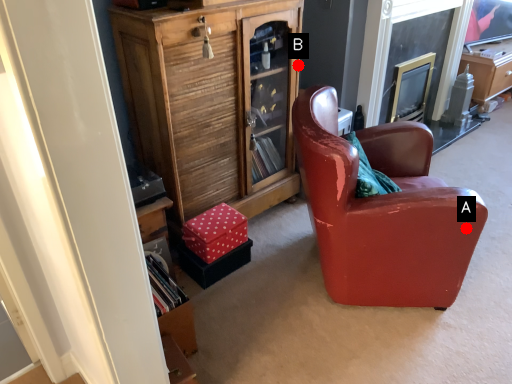
Question: Two points are circled on the image, labeled by A and B beside each circle. Which point is farther from the camera taking this photo?

Choices:
 (A) A is further
 (B) B is further

Answer: (B)